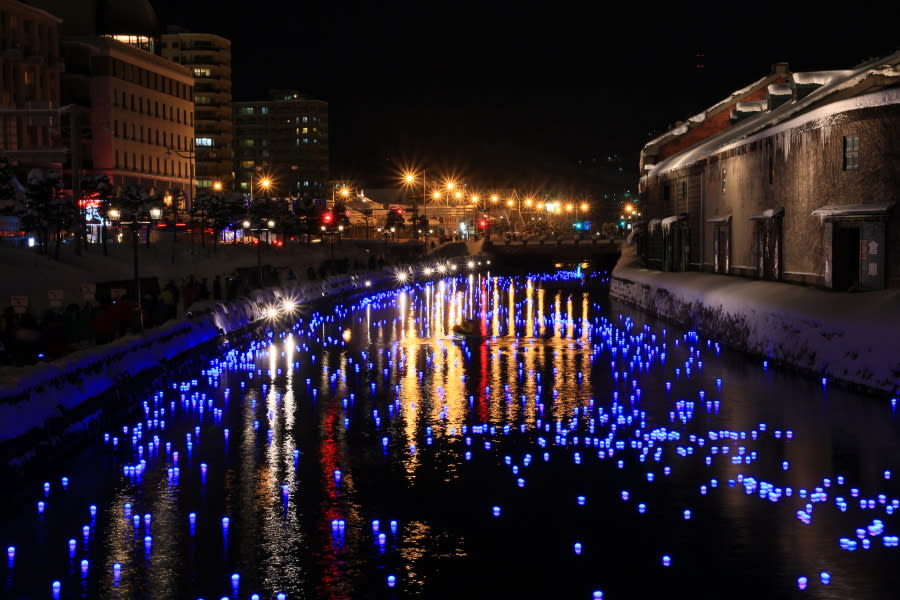
Identify the location of white lights in wall along left side of the water. (274, 312), (286, 305), (366, 282), (401, 277), (425, 270), (439, 270), (453, 268), (470, 263), (482, 263), (490, 261).